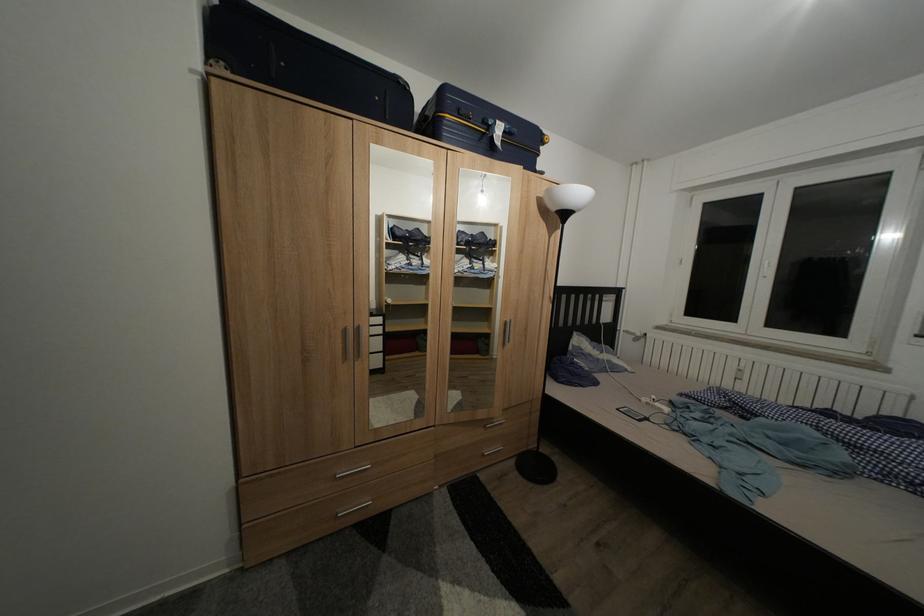
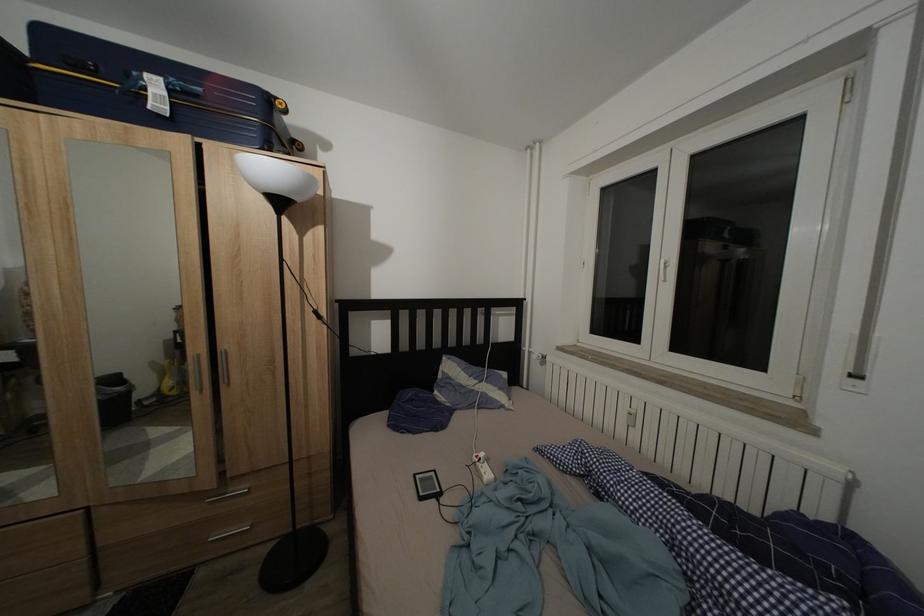
The point at [667,416] is marked in the first image. Where is the corresponding point in the second image?

(488, 483)